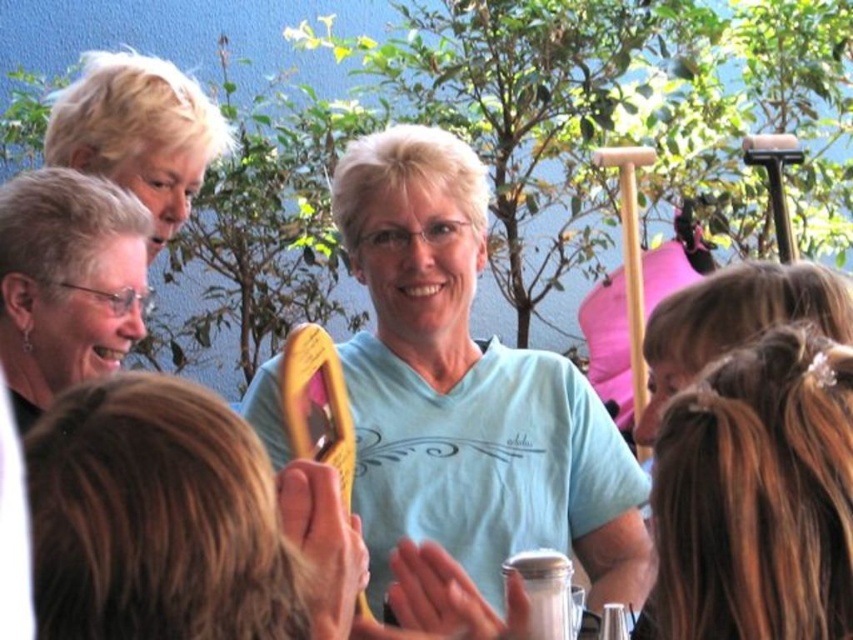
Is brown hair at center thinner than matte black hair at left?

Correct, brown hair at center's width is less than matte black hair at left's.

Can you confirm if brown hair at center is smaller than matte black hair at left?

Yes, brown hair at center is smaller than matte black hair at left.

Where is `brown hair at center`? brown hair at center is located at coordinates (756, 497).

Find the location of a particular element. The image size is (853, 640). brown hair at center is located at coordinates (756, 497).

Can you confirm if wooden spoon at center is positioned to the left of brown hair at center?

Yes, wooden spoon at center is to the left of brown hair at center.

In the scene shown: Does wooden spoon at center lie behind brown hair at center?

No.

Which is in front, point (335, 531) or point (740, 486)?

Positioned in front is point (740, 486).

Where is `wooden spoon at center`? wooden spoon at center is located at coordinates (180, 522).

You are a GUI agent. You are given a task and a screenshot of the screen. Output one action in this format:
    pyautogui.click(x=<x>, y=<y>)
    Task: Click on the light blue cotton shirt at center
    This screenshot has height=640, width=853.
    Given the screenshot: What is the action you would take?
    pyautogui.click(x=468, y=390)

Which of these two, light blue cotton shirt at center or brown hair at center, stands taller?

With more height is light blue cotton shirt at center.

At what (x,y) coordinates should I click in order to perform the action: click on light blue cotton shirt at center. Please return your answer as a coordinate pair (x, y). This screenshot has height=640, width=853. Looking at the image, I should click on (468, 390).